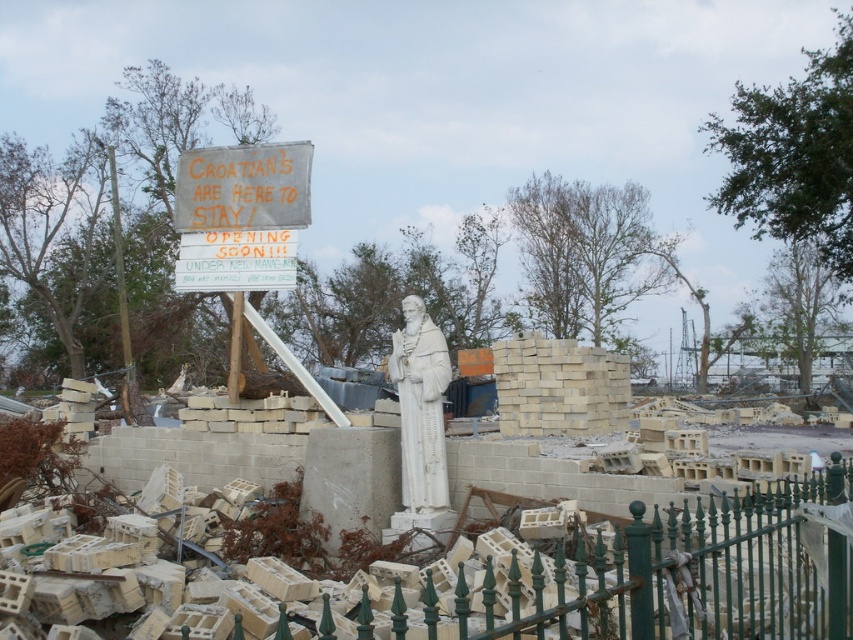
Is point (840, 536) positioned before point (421, 417)?

Yes.

Is green wrought iron fence at center thinner than white marble statue at center?

Incorrect, green wrought iron fence at center's width is not less than white marble statue at center's.

This screenshot has width=853, height=640. What do you see at coordinates (643, 576) in the screenshot?
I see `green wrought iron fence at center` at bounding box center [643, 576].

The image size is (853, 640). In order to click on green wrought iron fence at center in this screenshot , I will do `click(643, 576)`.

Is point (709, 577) behind point (276, 180)?

No, it is not.

Who is taller, white concrete statue at center or wooden sign at upper center?

Standing taller between the two is wooden sign at upper center.

Is point (711, 573) farther from camera compared to point (228, 216)?

No, it is not.

Locate an element on the screen. white concrete statue at center is located at coordinates (669, 576).

Can you confirm if green wrought iron fence at center is wider than white concrete statue at center?

In fact, green wrought iron fence at center might be narrower than white concrete statue at center.

Describe the element at coordinates (643, 576) in the screenshot. I see `green wrought iron fence at center` at that location.

Identify the location of green wrought iron fence at center. Image resolution: width=853 pixels, height=640 pixels. (643, 576).